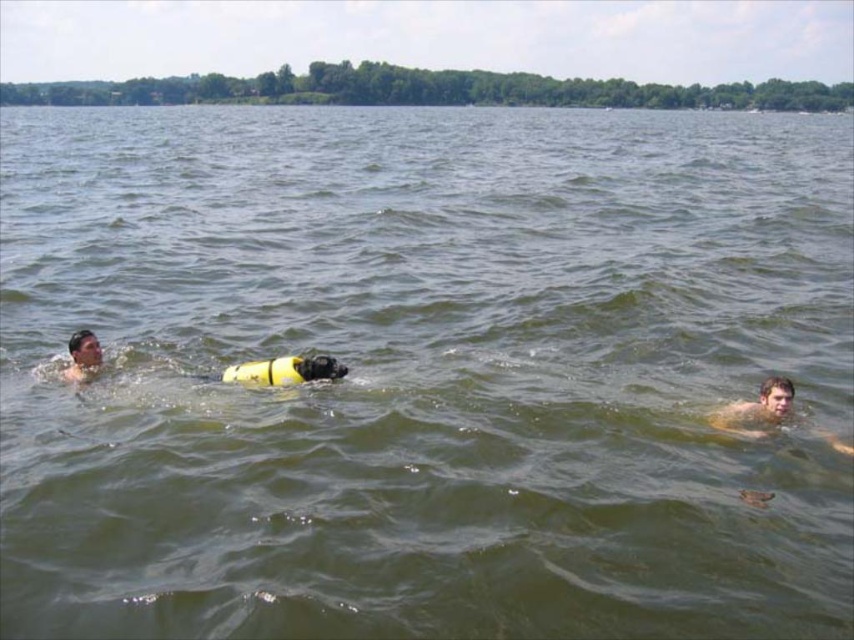
Question: Among these objects, which one is farthest from the camera?

Choices:
 (A) smooth skin diver at left
 (B) smooth skin diver at right

Answer: (A)

Question: Does smooth skin diver at right have a smaller size compared to smooth skin diver at left?

Choices:
 (A) no
 (B) yes

Answer: (A)

Question: Which of the following is the farthest from the observer?

Choices:
 (A) (98, 369)
 (B) (762, 426)

Answer: (A)

Question: Does smooth skin diver at right have a lesser width compared to smooth skin diver at left?

Choices:
 (A) yes
 (B) no

Answer: (B)

Question: Does smooth skin diver at right appear on the left side of smooth skin diver at left?

Choices:
 (A) no
 (B) yes

Answer: (A)